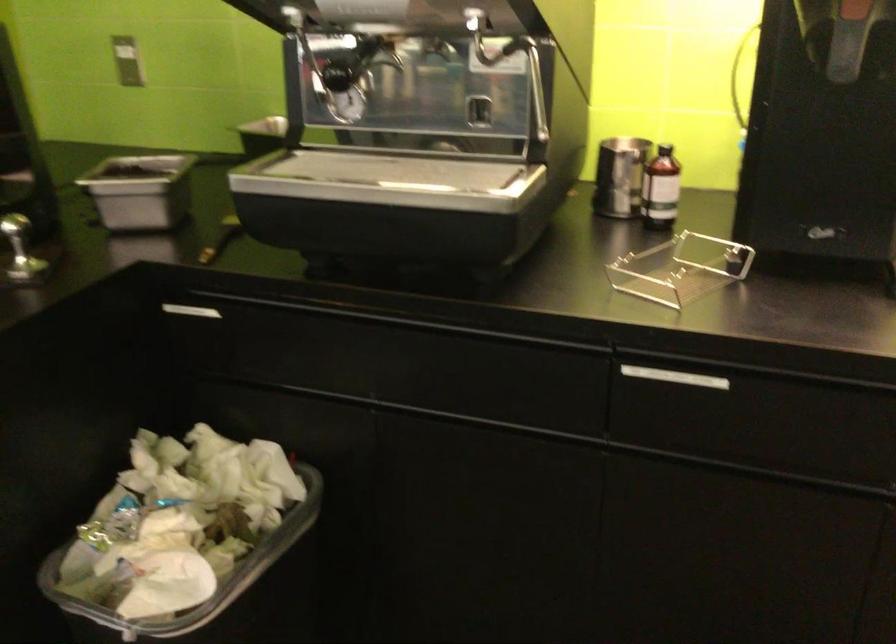
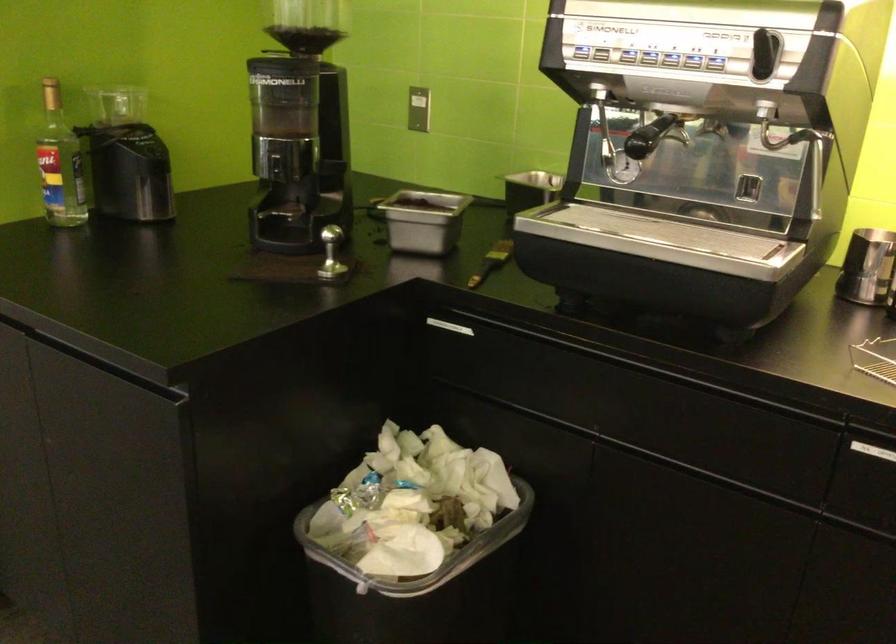
Which direction would the cameraman need to move to produce the second image?

The cameraman moved toward left, backward.